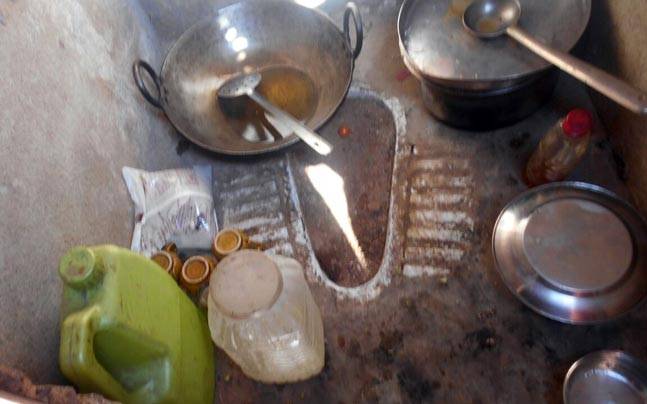
The width and height of the screenshot is (647, 404). Find the location of `green plastic jug`. green plastic jug is located at coordinates (140, 305).